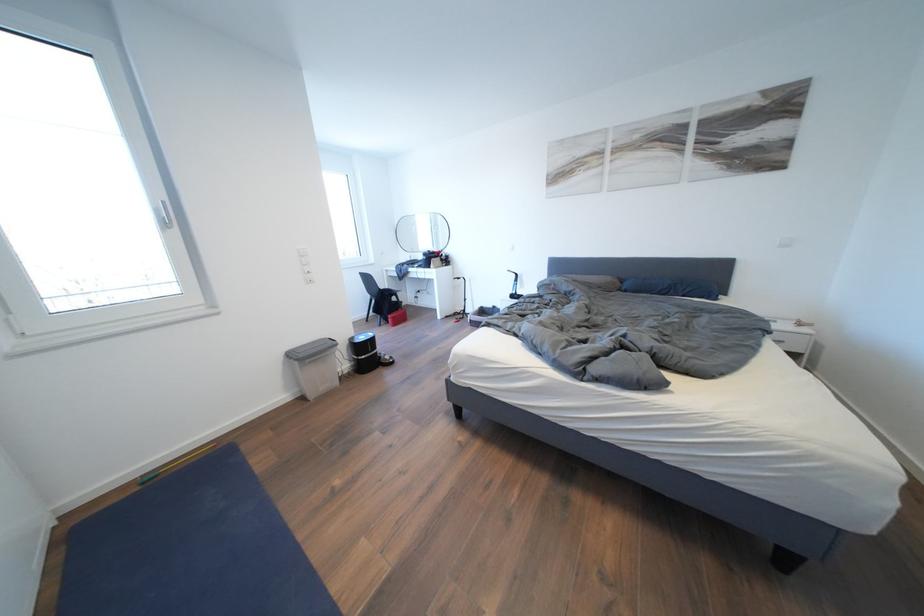
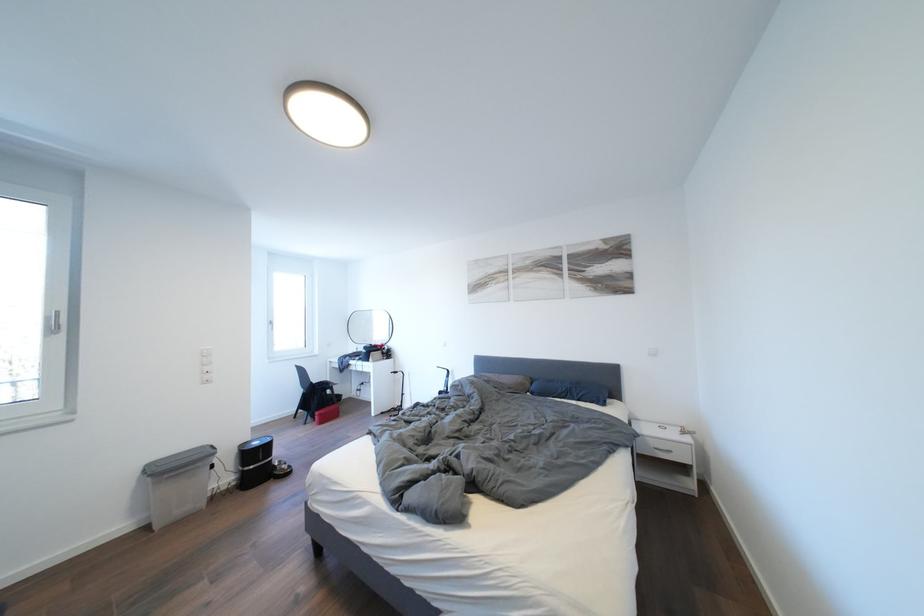
The point at [164,215] is marked in the first image. Where is the corresponding point in the second image?

(56, 323)